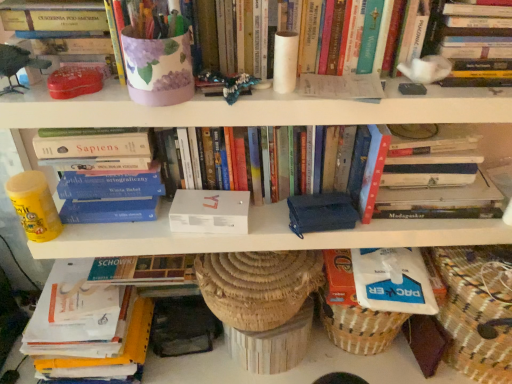
Identify the location of white matte box at center, the fourth book from the top. The height and width of the screenshot is (384, 512). (288, 163).

Describe the element at coordinates (288, 163) in the screenshot. I see `white matte box at center, the fourth book from the top` at that location.

You are a GUI agent. You are given a task and a screenshot of the screen. Output one action in this format:
    pyautogui.click(x=<x>, y=<y>)
    Task: Click on the white matte box at center, the second paperback book when ordered from right to left
    The image size is (512, 384).
    Given the screenshot: What is the action you would take?
    pyautogui.click(x=210, y=212)

This screenshot has width=512, height=384. What do you see at coordinates (53, 15) in the screenshot?
I see `matte red box at upper left, positioned as the 4th book in bottom-to-top order` at bounding box center [53, 15].

The width and height of the screenshot is (512, 384). I want to click on hardcover book at upper right, which appears as the sixth book when ordered from the bottom, so [473, 43].

This screenshot has width=512, height=384. Identify the location of white matte box at center, the fourth book from the top. (288, 163).

From the image's perspective, which is above, hardcover book at upper right, arranged as the 1th book when viewed from the top, or matte red box at upper left, positioned as the 4th book in bottom-to-top order?

hardcover book at upper right, arranged as the 1th book when viewed from the top.

Does hardcover book at upper right, arranged as the 1th book when viewed from the top, contain matte red box at upper left, positioned as the 4th book in bottom-to-top order?

No, hardcover book at upper right, arranged as the 1th book when viewed from the top, does not contain matte red box at upper left, positioned as the 4th book in bottom-to-top order.

From a real-world perspective, is hardcover book at upper right, which appears as the sixth book when ordered from the bottom, over matte red box at upper left, positioned as the 4th book in bottom-to-top order?

Yes, from a real-world perspective, hardcover book at upper right, which appears as the sixth book when ordered from the bottom, is above matte red box at upper left, positioned as the 4th book in bottom-to-top order.

Is point (426, 23) closer or farther from the camera than point (324, 196)?

Point (426, 23).

From the matte blue wallet at center, arranged as the first paperback book when viewed from the right, count the 1st book to the left and point to it. Please provide its 2D coordinates.

[(331, 37)]

What's the angular difference between matte purple vase at upper center, which appears as the 2th book when viewed from the top, and matte blue wallet at center, arranged as the first paperback book when viewed from the right,'s facing directions?

They differ by 0.000225 degrees in their facing directions.

Measure the distance from white matte box at center, the first paperback book from the left, to matte red box at upper left, the 3th book positioned from the top.

white matte box at center, the first paperback book from the left, and matte red box at upper left, the 3th book positioned from the top, are 15.42 inches apart.

Does white matte box at center, the first paperback book from the left, have a greater width compared to matte red box at upper left, the 3th book positioned from the top?

Incorrect, the width of white matte box at center, the first paperback book from the left, does not surpass that of matte red box at upper left, the 3th book positioned from the top.

From the image's perspective, between white matte box at center, the second paperback book when ordered from right to left, and matte red box at upper left, positioned as the 4th book in bottom-to-top order, who is located below?

white matte box at center, the second paperback book when ordered from right to left, is shown below in the image.

Between point (225, 213) and point (103, 25), which one is positioned in front?

The point (103, 25) is closer.

Is matte plastic toy at left taller or shorter than matte purple vase at upper center, which appears as the 2th book when viewed from the top?

Clearly, matte plastic toy at left is shorter compared to matte purple vase at upper center, which appears as the 2th book when viewed from the top.

Where is `toy below the matte purple vase at upper center, which ranks as the fifth book in bottom-to-top order (from a real-world perspective)`? toy below the matte purple vase at upper center, which ranks as the fifth book in bottom-to-top order (from a real-world perspective) is located at coordinates (17, 65).

Is the depth of matte plastic toy at left less than that of matte purple vase at upper center, which appears as the 2th book when viewed from the top?

Yes, matte plastic toy at left is closer to the viewer.

Do you think matte plastic toy at left is within matte purple vase at upper center, which ranks as the fifth book in bottom-to-top order, or outside of it?

matte plastic toy at left is not inside matte purple vase at upper center, which ranks as the fifth book in bottom-to-top order, it's outside.

This screenshot has width=512, height=384. I want to click on book that is the 3rd one above the matte blue wallet at center, arranged as the first paperback book when viewed from the right (from a real-world perspective), so click(53, 15).

From the image's perspective, between matte red box at upper left, positioned as the 4th book in bottom-to-top order, and matte blue wallet at center, positioned as the 2th paperback book in left-to-right order, which one is located above?

From the image's view, matte red box at upper left, positioned as the 4th book in bottom-to-top order, is above.

Considering the positions of objects matte red box at upper left, positioned as the 4th book in bottom-to-top order, and matte blue wallet at center, arranged as the first paperback book when viewed from the right, in the image provided, who is more to the right, matte red box at upper left, positioned as the 4th book in bottom-to-top order, or matte blue wallet at center, arranged as the first paperback book when viewed from the right,?

From the viewer's perspective, matte blue wallet at center, arranged as the first paperback book when viewed from the right, appears more on the right side.

Measure the distance between matte red box at upper left, the 3th book positioned from the top, and matte blue wallet at center, positioned as the 2th paperback book in left-to-right order.

matte red box at upper left, the 3th book positioned from the top, is 22.00 inches away from matte blue wallet at center, positioned as the 2th paperback book in left-to-right order.

Is point (190, 209) closer or farther from the camera than point (239, 173)?

Point (190, 209) is positioned closer to the camera compared to point (239, 173).

Could you measure the distance between white matte box at center, the second paperback book when ordered from right to left, and white matte box at center, which ranks as the third book in bottom-to-top order?

white matte box at center, the second paperback book when ordered from right to left, is 5.48 inches away from white matte box at center, which ranks as the third book in bottom-to-top order.

Considering the relative sizes of white matte box at center, the second paperback book when ordered from right to left, and white matte box at center, which ranks as the third book in bottom-to-top order, in the image provided, is white matte box at center, the second paperback book when ordered from right to left, bigger than white matte box at center, which ranks as the third book in bottom-to-top order,?

No, white matte box at center, the second paperback book when ordered from right to left, is not bigger than white matte box at center, which ranks as the third book in bottom-to-top order.

Does white matte box at center, the first paperback book from the left, touch white matte box at center, the fourth book from the top?

No, white matte box at center, the first paperback book from the left, is not making contact with white matte box at center, the fourth book from the top.

Can you confirm if hardcover book at upper right, arranged as the 1th book when viewed from the top, is smaller than hardcover book at left, acting as the 2th book starting from the bottom?

Indeed, hardcover book at upper right, arranged as the 1th book when viewed from the top, has a smaller size compared to hardcover book at left, acting as the 2th book starting from the bottom.

Which object is wider, hardcover book at upper right, arranged as the 1th book when viewed from the top, or hardcover book at left, acting as the 2th book starting from the bottom?

hardcover book at left, acting as the 2th book starting from the bottom, is wider.

From a real-world perspective, is hardcover book at upper right, arranged as the 1th book when viewed from the top, on hardcover book at left, acting as the 2th book starting from the bottom?

Yes.

Where is `book that is the 1st object located behind the hardcover book at upper right, which appears as the sixth book when ordered from the bottom`? The image size is (512, 384). book that is the 1st object located behind the hardcover book at upper right, which appears as the sixth book when ordered from the bottom is located at coordinates [x=104, y=173].

From a real-world perspective, count 2nd books downward from the hardcover book at upper right, which appears as the sixth book when ordered from the bottom, and point to it. Please provide its 2D coordinates.

[(53, 15)]

Locate an element on the screen. paperback book that is the 2nd object located below the matte purple vase at upper center, which appears as the 2th book when viewed from the top (from the image's perspective) is located at coordinates (321, 213).

Which object lies nearer to the anchor point matte red box at upper left, the 3th book positioned from the top, brown woven basket at lower right or matte blue wallet at center, arranged as the first paperback book when viewed from the right?

The object closer to matte red box at upper left, the 3th book positioned from the top, is matte blue wallet at center, arranged as the first paperback book when viewed from the right.

Based on their spatial positions, is matte plastic toy at left or matte blue wallet at center, arranged as the first paperback book when viewed from the right, closer to white paper book at lower left, which is the 1th book in bottom-to-top order?

matte blue wallet at center, arranged as the first paperback book when viewed from the right, is positioned closer to the anchor white paper book at lower left, which is the 1th book in bottom-to-top order.

Estimate the real-world distances between objects in this image. Which object is closer to matte plastic toy at left, hardcover book at left, the 5th book from the top, or hardcover book at upper right, which appears as the sixth book when ordered from the bottom?

Among the two, hardcover book at left, the 5th book from the top, is located nearer to matte plastic toy at left.

Estimate the real-world distances between objects in this image. Which object is further from matte red box at upper left, the 3th book positioned from the top, matte blue wallet at center, arranged as the first paperback book when viewed from the right, or brown woven basket at lower right?

brown woven basket at lower right.

From the image, which object appears to be farther from hardcover book at left, the 5th book from the top, brown woven basket at lower right or matte purple vase at upper center, which ranks as the fifth book in bottom-to-top order?

brown woven basket at lower right.

Estimate the real-world distances between objects in this image. Which object is further from matte red box at upper left, positioned as the 4th book in bottom-to-top order, matte plastic toy at left or matte blue wallet at center, arranged as the first paperback book when viewed from the right?

Among the two, matte blue wallet at center, arranged as the first paperback book when viewed from the right, is located further to matte red box at upper left, positioned as the 4th book in bottom-to-top order.

From the image, which object appears to be farther from brown woven basket at lower right, hardcover book at upper right, which appears as the sixth book when ordered from the bottom, or matte red box at upper left, positioned as the 4th book in bottom-to-top order?

The object further to brown woven basket at lower right is matte red box at upper left, positioned as the 4th book in bottom-to-top order.

Estimate the real-world distances between objects in this image. Which object is closer to white paper book at lower left, which is the 1th book in bottom-to-top order, white matte box at center, which ranks as the third book in bottom-to-top order, or white matte box at center, the first paperback book from the left?

white matte box at center, the first paperback book from the left.

This screenshot has width=512, height=384. Find the location of `paperback book between hardcover book at left, acting as the 2th book starting from the bottom, and matte blue wallet at center, arranged as the first paperback book when viewed from the right`. paperback book between hardcover book at left, acting as the 2th book starting from the bottom, and matte blue wallet at center, arranged as the first paperback book when viewed from the right is located at coordinates (210, 212).

Identify the location of paperback book between matte purple vase at upper center, which appears as the 2th book when viewed from the top, and hardcover book at upper right, arranged as the 1th book when viewed from the top, in the horizontal direction. (321, 213).

The height and width of the screenshot is (384, 512). I want to click on paperback book situated between matte purple vase at upper center, which appears as the 2th book when viewed from the top, and brown woven basket at lower right from left to right, so click(x=321, y=213).

Where is `book between matte red box at upper left, positioned as the 4th book in bottom-to-top order, and white matte box at center, which ranks as the third book in bottom-to-top order, in the horizontal direction`? This screenshot has width=512, height=384. book between matte red box at upper left, positioned as the 4th book in bottom-to-top order, and white matte box at center, which ranks as the third book in bottom-to-top order, in the horizontal direction is located at coordinates (104, 173).